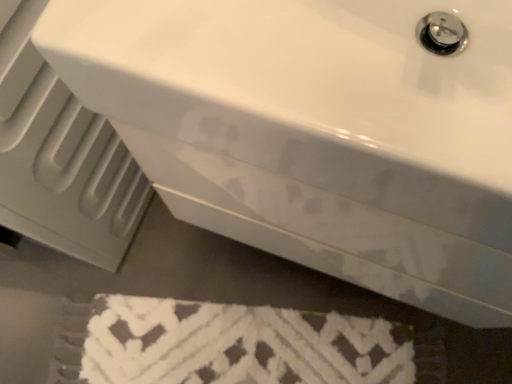
I want to click on free spot below white textured bath towel at lower center (from a real-world perspective), so click(250, 351).